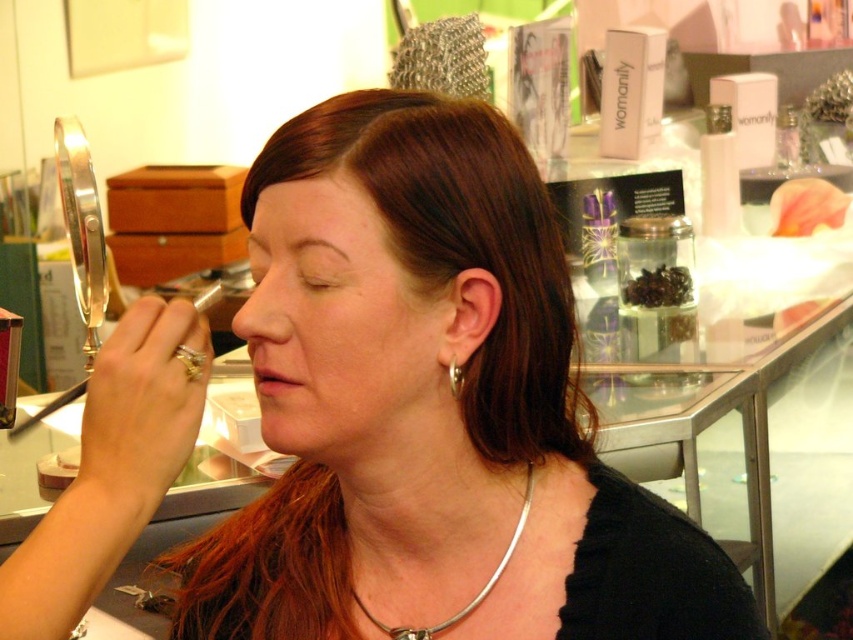
Can you confirm if silver metallic necklace at center is thinner than gold shiny earring at ear?

In fact, silver metallic necklace at center might be wider than gold shiny earring at ear.

Where is `silver metallic necklace at center`? This screenshot has height=640, width=853. silver metallic necklace at center is located at coordinates (476, 593).